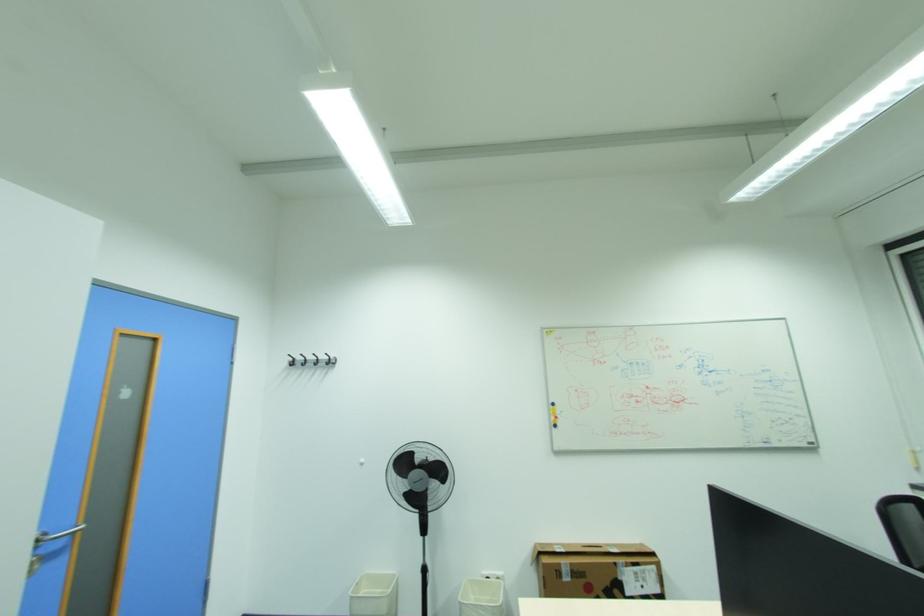
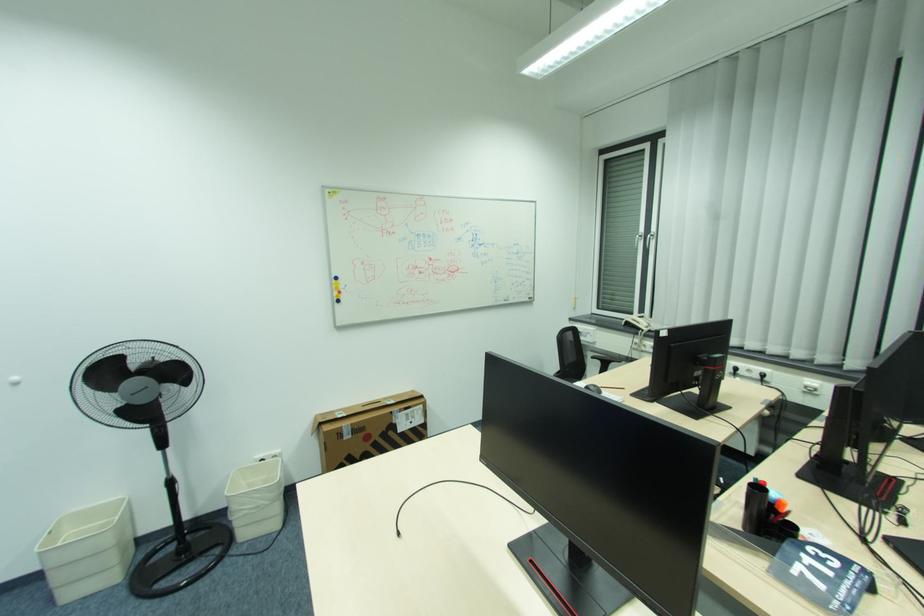
Find the pixel in the second image that matches (x=565, y=564) in the first image.

(346, 427)